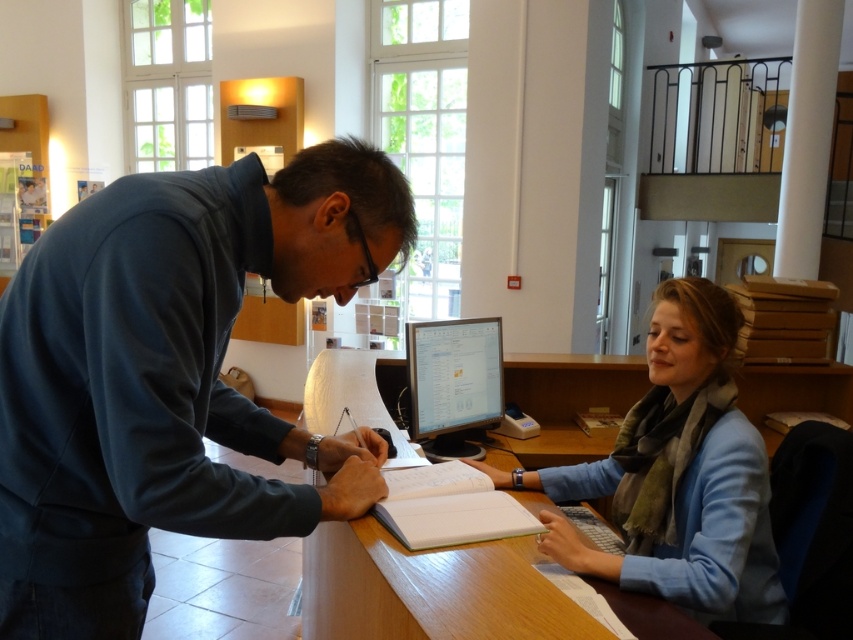
Based on the photo, you are a person who needs to place a 12 inch long object between the dark blue fleece at left and the wooden table at center. Is there enough space to place it without moving either object?

The dark blue fleece at left is 16.97 inches away from the wooden table at center, so yes, there is enough space to place a 12 inch long object between them without moving either object.

You are organizing a small desk space and need to place both the dark blue fleece at left and the white paper notebook at center. If the desk has a width of 30 cm, can both items fit side by side without overlapping?

The dark blue fleece at left is wider than the white paper notebook at center. However, since the exact widths aren

You are a person who needs to reach the white paper notebook at center from the dark blue fleece at left. Can you comfortably do so without moving your chair?

The distance between the dark blue fleece at left and the white paper notebook at center is 12.06 inches, which is a short reach, so yes, you can comfortably reach the white paper notebook at center without moving your chair.